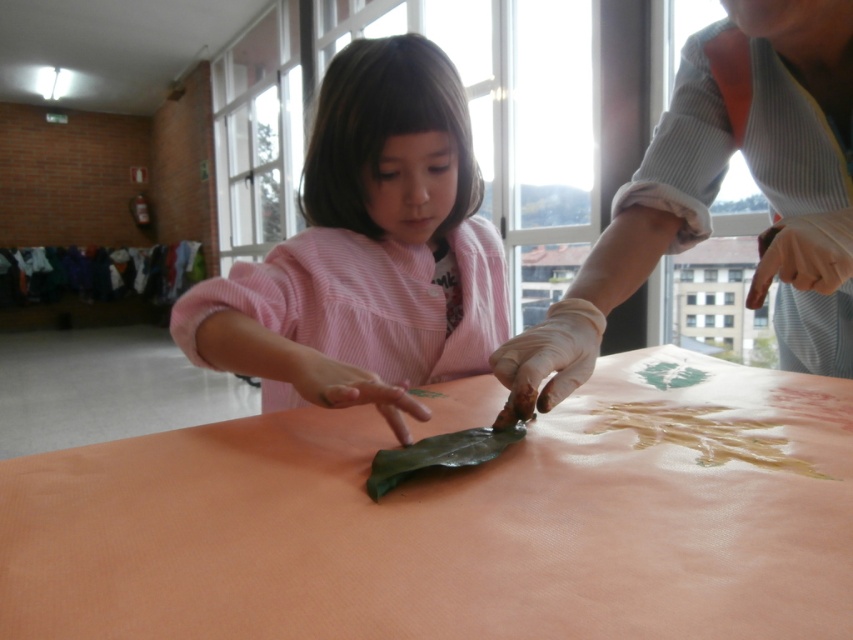
You are a teacher observing a child working on an art project. The child is sitting at the orange matte table at center and wearing the pink striped sweater at center. From your perspective, which object is closer to you?

The orange matte table at center is closer to the viewer than the pink striped sweater at center.